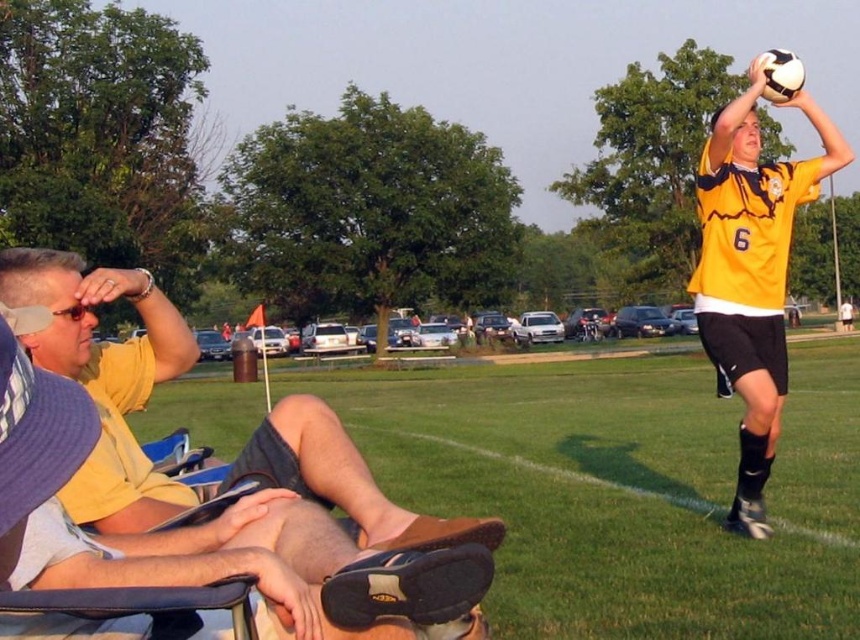
Who is shorter, dark blue fabric folding chair at lower left or yellow jersey at upper right?

Standing shorter between the two is dark blue fabric folding chair at lower left.

Does dark blue fabric folding chair at lower left have a smaller size compared to yellow jersey at upper right?

Yes.

The height and width of the screenshot is (640, 860). In order to click on dark blue fabric folding chair at lower left in this screenshot , I will do `click(37, 454)`.

Where is `dark blue fabric folding chair at lower left`? Image resolution: width=860 pixels, height=640 pixels. dark blue fabric folding chair at lower left is located at coordinates (37, 454).

Does matte yellow sunglasses at upper left have a greater height compared to yellow jersey at upper right?

In fact, matte yellow sunglasses at upper left may be shorter than yellow jersey at upper right.

Image resolution: width=860 pixels, height=640 pixels. What do you see at coordinates (50, 305) in the screenshot? I see `matte yellow sunglasses at upper left` at bounding box center [50, 305].

Find the location of a particular element. The image size is (860, 640). matte yellow sunglasses at upper left is located at coordinates pyautogui.click(x=50, y=305).

What do you see at coordinates (105, 380) in the screenshot? This screenshot has width=860, height=640. I see `yellow cotton shirt at left` at bounding box center [105, 380].

Between yellow cotton shirt at left and matte yellow sunglasses at upper left, which one has more height?

yellow cotton shirt at left is taller.

Find the location of `yellow cotton shirt at left`. yellow cotton shirt at left is located at coordinates (105, 380).